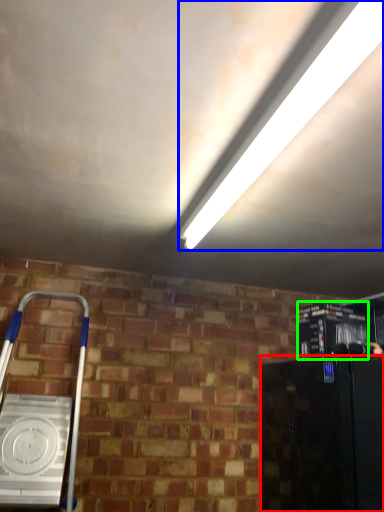
Question: Which is nearer to the appliance (highlighted by a red box)? light (highlighted by a blue box) or appliance (highlighted by a green box).

Choices:
 (A) light
 (B) appliance

Answer: (B)